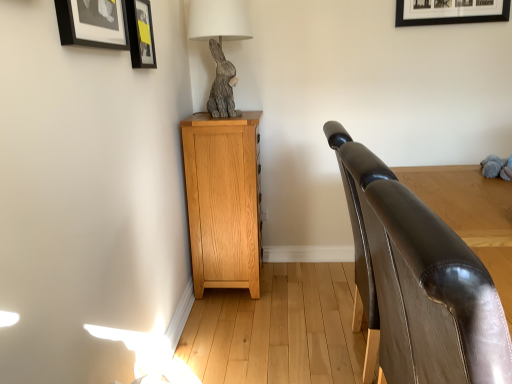
Question: From a real-world perspective, relative to light oak cabinet at left, is shiny brown leather armrest at right vertically above or below?

Choices:
 (A) below
 (B) above

Answer: (B)

Question: Looking at the image, does shiny brown leather armrest at right seem bigger or smaller compared to light oak cabinet at left?

Choices:
 (A) small
 (B) big

Answer: (A)

Question: Which object is positioned farthest from the light oak cabinet at left?

Choices:
 (A) shiny brown leather armrest at right
 (B) matte black picture frame at upper left, which is the 1th picture frame from back to front
 (C) black matte picture frame at upper left, which is counted as the second picture frame, starting from the back
 (D) gray textured rabbit at upper left
 (E) gray plush toy at right

Answer: (E)

Question: Which is farther from the shiny brown leather armrest at right?

Choices:
 (A) light oak cabinet at left
 (B) gray plush toy at right
 (C) matte black picture frame at upper left, which is the 1th picture frame from back to front
 (D) gray textured rabbit at upper left
 (E) black matte picture frame at upper left, the first picture frame in the front-to-back sequence

Answer: (D)